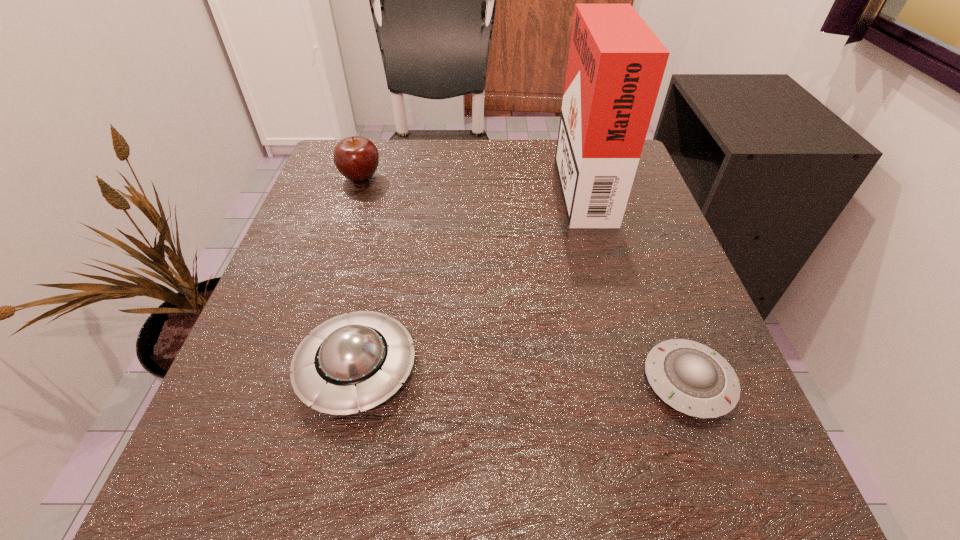
This screenshot has height=540, width=960. In order to click on free space located on the right of the taller saucer in this screenshot , I will do `click(471, 369)`.

Identify the location of free space located on the back of the shortest object. This screenshot has height=540, width=960. (644, 263).

Locate an element on the screen. cigarette case that is at the far edge is located at coordinates (616, 63).

Image resolution: width=960 pixels, height=540 pixels. I want to click on apple that is at the far edge, so click(356, 158).

Locate an element on the screen. apple present at the left edge is located at coordinates (356, 158).

Identify the location of saucer present at the left edge. The height and width of the screenshot is (540, 960). (356, 361).

Locate an element on the screen. This screenshot has height=540, width=960. cigarette case that is at the right edge is located at coordinates (616, 63).

This screenshot has height=540, width=960. Identify the location of saucer positioned at the right edge. (692, 378).

Where is `object at the far left corner`? The height and width of the screenshot is (540, 960). object at the far left corner is located at coordinates (356, 158).

The image size is (960, 540). In order to click on object that is at the far right corner in this screenshot , I will do pyautogui.click(x=616, y=63).